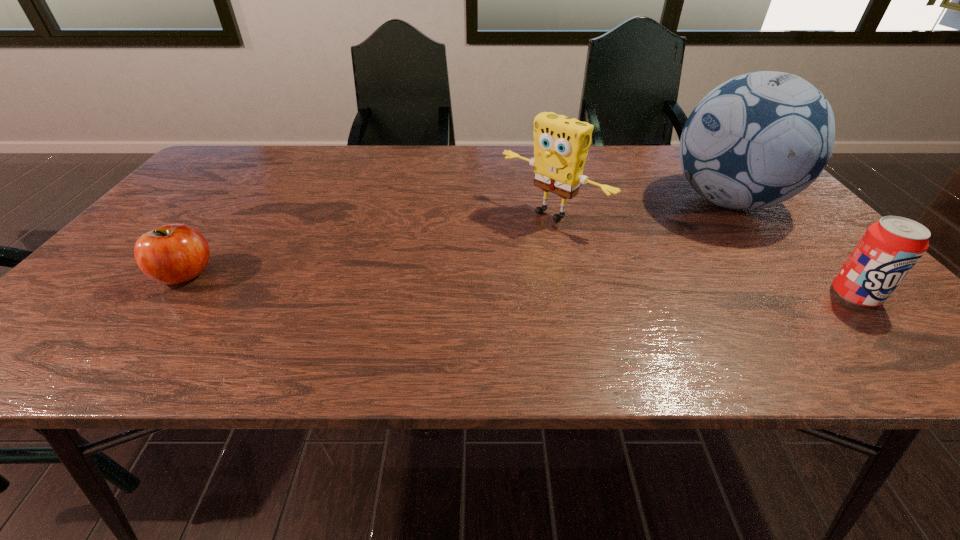
This screenshot has width=960, height=540. I want to click on vacant area located on the side with brand of the tallest object, so click(x=588, y=254).

Find the location of a particular element. The width and height of the screenshot is (960, 540). free spot located 0.340m on the side with brand of the tallest object is located at coordinates (581, 256).

Find the location of a particular element. The image size is (960, 540). blank space located 0.270m on the side with brand of the tallest object is located at coordinates (604, 248).

The height and width of the screenshot is (540, 960). In order to click on object that is at the far edge in this screenshot , I will do `click(758, 139)`.

Locate an element on the screen. The image size is (960, 540). apple present at the near edge is located at coordinates (172, 254).

Where is `soda can that is positioned at the near edge`? This screenshot has height=540, width=960. soda can that is positioned at the near edge is located at coordinates (889, 249).

Locate an element on the screen. The height and width of the screenshot is (540, 960). object that is at the left edge is located at coordinates (172, 254).

Image resolution: width=960 pixels, height=540 pixels. What are the coordinates of `soda can that is positioned at the right edge` in the screenshot? It's located at (889, 249).

At what (x,y) coordinates should I click in order to perform the action: click on soccer ball situated at the right edge. Please return your answer as a coordinate pair (x, y). The height and width of the screenshot is (540, 960). Looking at the image, I should click on (758, 139).

You are a GUI agent. You are given a task and a screenshot of the screen. Output one action in this format:
    pyautogui.click(x=<x>, y=<y>)
    Task: Click on the object present at the near left corner
    The width and height of the screenshot is (960, 540).
    Given the screenshot: What is the action you would take?
    pyautogui.click(x=172, y=254)